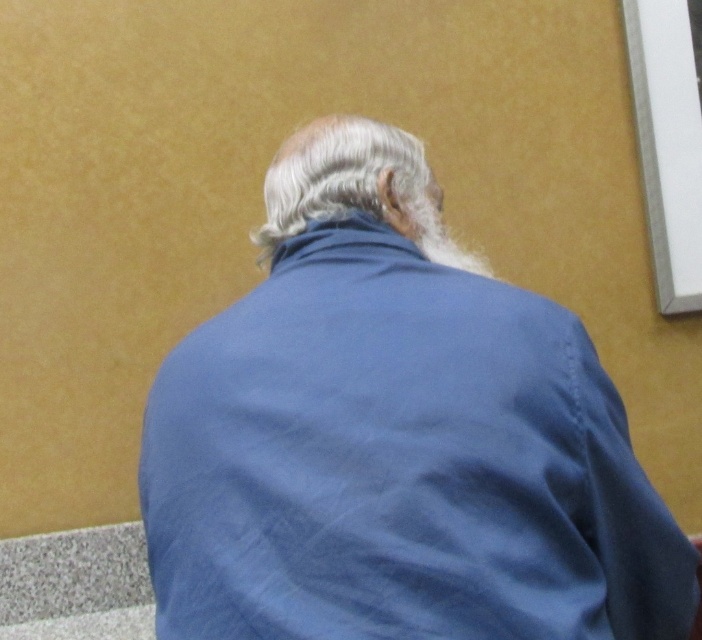
In the scene shown: You are a photographer adjusting your camera settings to capture the scene. You notice the blue fabric jacket at center and the white matte hair at center. Which object should you focus on first if you want to ensure both are in sharp focus, considering their positions?

The blue fabric jacket at center is below white matte hair at center, so focusing on the white matte hair at center first would ensure both are in sharp focus since it is closer to the camera.

In the scene shown: You are standing in front of a person wearing a blue fabric jacket at center. If you want to hand them a book without moving closer than 3 feet, can you reach them?

The blue fabric jacket at center is 31.98 inches away from the camera, which is approximately 2.66 feet. Since this distance is less than 3 feet, you cannot maintain the 3 feet distance while handing them the book.